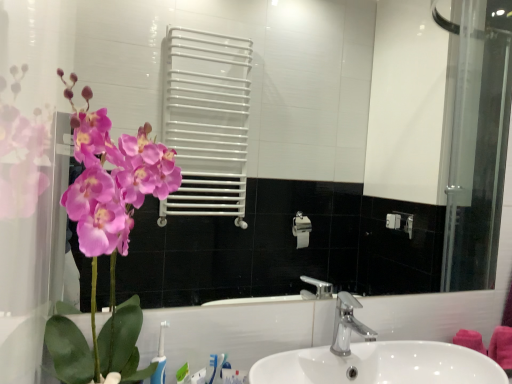
Question: Is silver metallic faucet at center further to the viewer compared to matte pink orchid at left?

Choices:
 (A) no
 (B) yes

Answer: (B)

Question: Is silver metallic faucet at center positioned in front of matte pink orchid at left?

Choices:
 (A) no
 (B) yes

Answer: (A)

Question: From the image's perspective, would you say silver metallic faucet at center is shown under matte pink orchid at left?

Choices:
 (A) no
 (B) yes

Answer: (B)

Question: Does silver metallic faucet at center have a greater width compared to matte pink orchid at left?

Choices:
 (A) no
 (B) yes

Answer: (A)

Question: From a real-world perspective, is silver metallic faucet at center positioned under matte pink orchid at left based on gravity?

Choices:
 (A) no
 (B) yes

Answer: (B)

Question: Is point (473, 256) closer or farther from the camera than point (352, 301)?

Choices:
 (A) closer
 (B) farther

Answer: (B)

Question: From the image's perspective, is white glossy mirror at upper center located above or below white glossy sink at center?

Choices:
 (A) below
 (B) above

Answer: (B)

Question: In terms of height, does white glossy mirror at upper center look taller or shorter compared to white glossy sink at center?

Choices:
 (A) short
 (B) tall

Answer: (B)

Question: Is white glossy mirror at upper center in front of or behind white glossy sink at center in the image?

Choices:
 (A) behind
 (B) front

Answer: (A)

Question: From a real-world perspective, is blue plastic toothbrush at lower left above or below silver metallic faucet at center?

Choices:
 (A) above
 (B) below

Answer: (B)

Question: Visually, is blue plastic toothbrush at lower left positioned to the left or to the right of silver metallic faucet at center?

Choices:
 (A) left
 (B) right

Answer: (A)

Question: Is blue plastic toothbrush at lower left spatially inside silver metallic faucet at center, or outside of it?

Choices:
 (A) inside
 (B) outside

Answer: (B)

Question: From the image's perspective, is blue plastic toothbrush at lower left positioned above or below silver metallic faucet at center?

Choices:
 (A) above
 (B) below

Answer: (B)

Question: In the image, is matte pink orchid at left positioned in front of or behind white glossy mirror at upper center?

Choices:
 (A) front
 (B) behind

Answer: (A)

Question: Based on their sizes in the image, would you say matte pink orchid at left is bigger or smaller than white glossy mirror at upper center?

Choices:
 (A) big
 (B) small

Answer: (A)